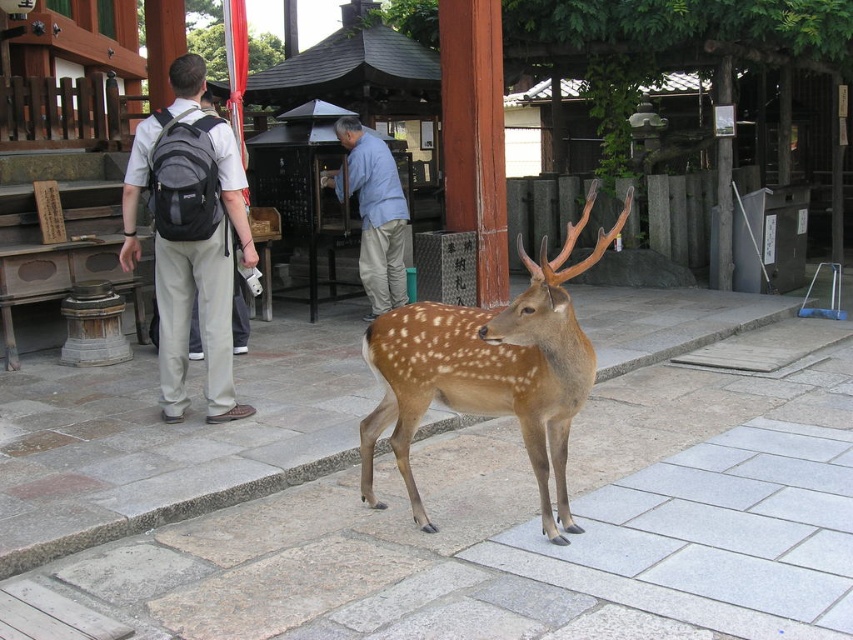
Can you confirm if gray fabric backpack at upper left is shorter than light blue cotton shirt at center?

In fact, gray fabric backpack at upper left may be taller than light blue cotton shirt at center.

Between gray fabric backpack at upper left and light blue cotton shirt at center, which one is positioned higher?

light blue cotton shirt at center

Is point (206, 140) behind point (375, 280)?

No, it is in front of (375, 280).

Where is `gray fabric backpack at upper left`? This screenshot has width=853, height=640. gray fabric backpack at upper left is located at coordinates (190, 236).

Which is above, brown speckled fur at center or gray fabric backpack at upper left?

Positioned higher is gray fabric backpack at upper left.

Is point (532, 435) closer to viewer compared to point (219, 136)?

Yes.

Where is `brown speckled fur at center`? The height and width of the screenshot is (640, 853). brown speckled fur at center is located at coordinates (489, 371).

The image size is (853, 640). I want to click on brown speckled fur at center, so click(x=489, y=371).

Which is more to the left, brown speckled fur at center or light blue cotton shirt at center?

light blue cotton shirt at center is more to the left.

You are a GUI agent. You are given a task and a screenshot of the screen. Output one action in this format:
    pyautogui.click(x=<x>, y=<y>)
    Task: Click on the brown speckled fur at center
    The image size is (853, 640).
    Given the screenshot: What is the action you would take?
    pyautogui.click(x=489, y=371)